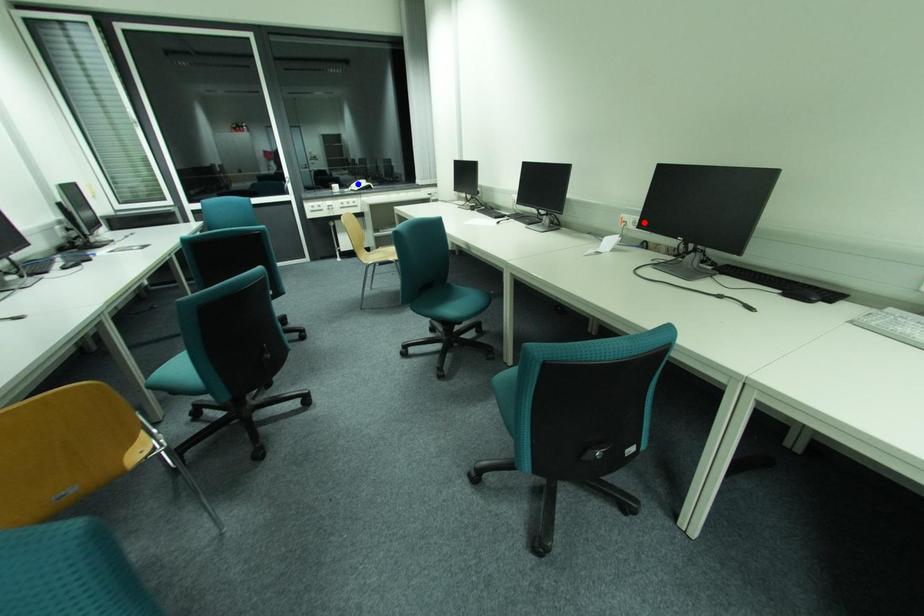
Question: Which of the two points in the image is closer to the camera?

Choices:
 (A) Blue point is closer.
 (B) Red point is closer.

Answer: (B)